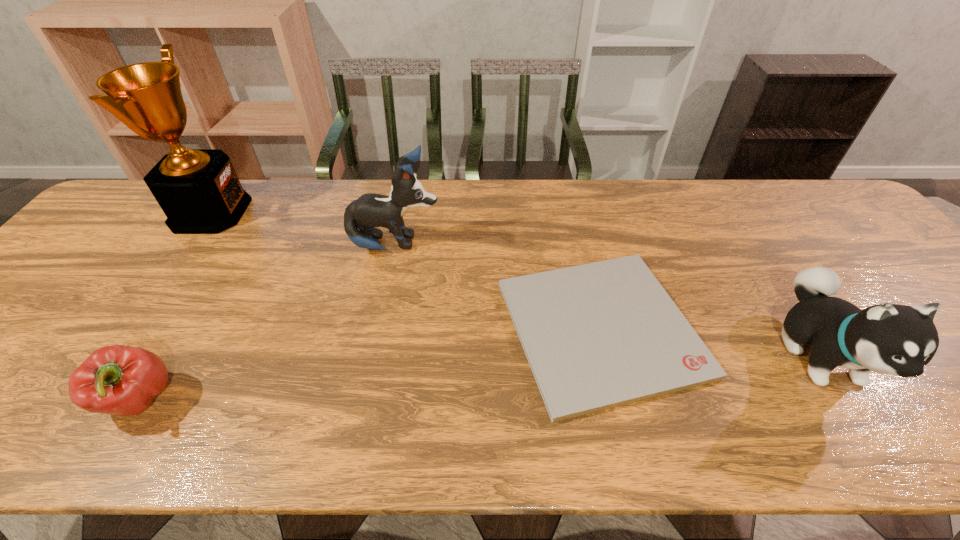
This screenshot has height=540, width=960. Identify the location of vacant area situated 0.060m at the face of the shorter puppy. (x=881, y=450).

Find the location of a particular element. Image resolution: width=960 pixels, height=540 pixels. free location located on the back of the fourth tallest object is located at coordinates (230, 246).

Image resolution: width=960 pixels, height=540 pixels. What are the coordinates of `free space located on the left of the shortest object` in the screenshot? It's located at (333, 328).

Locate an element on the screen. Image resolution: width=960 pixels, height=540 pixels. object at the far edge is located at coordinates click(x=198, y=190).

Image resolution: width=960 pixels, height=540 pixels. What are the coordinates of `puppy at the near edge` in the screenshot? It's located at (891, 339).

Identify the location of bell pepper located at the near edge. The height and width of the screenshot is (540, 960). (119, 380).

The width and height of the screenshot is (960, 540). I want to click on clipboard present at the near edge, so click(601, 335).

Where is `free location at the far edge`? free location at the far edge is located at coordinates (619, 201).

Locate an element on the screen. free location at the near edge of the desktop is located at coordinates pos(469,430).

The width and height of the screenshot is (960, 540). What are the coordinates of `free location at the right edge` in the screenshot? It's located at (842, 235).